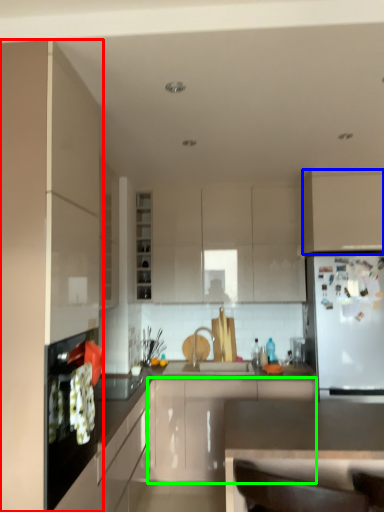
Question: Estimate the real-world distances between objects in this image. Which object is farther from cabinetry (highlighted by a red box), cabinetry (highlighted by a blue box) or cabinetry (highlighted by a green box)?

Choices:
 (A) cabinetry
 (B) cabinetry

Answer: (A)